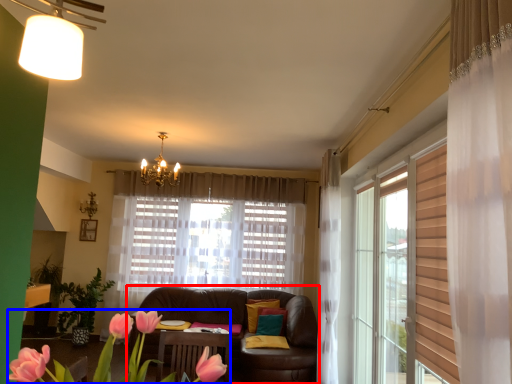
Question: Among these objects, which one is nearest to the camera, studio couch (highlighted by a red box) or floral arrangement (highlighted by a blue box)?

Choices:
 (A) studio couch
 (B) floral arrangement

Answer: (B)